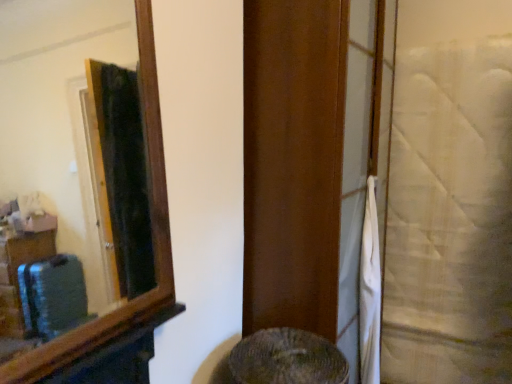
Measure the distance between point (325, 376) and camera.

The distance of point (325, 376) from camera is 1.40 meters.

This screenshot has width=512, height=384. In order to click on knitted fabric swivel chair at center in this screenshot , I will do `click(287, 359)`.

Describe the element at coordinates (287, 359) in the screenshot. This screenshot has width=512, height=384. I see `knitted fabric swivel chair at center` at that location.

Where is `knitted fabric swivel chair at center`? This screenshot has height=384, width=512. knitted fabric swivel chair at center is located at coordinates (287, 359).